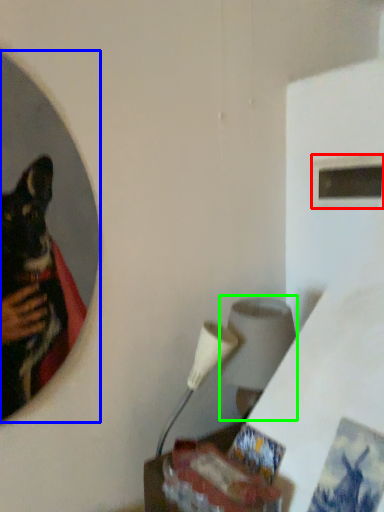
Question: Which object is the closest to the window (highlighted by a red box)? Choose among these: mirror (highlighted by a blue box) or lamp (highlighted by a green box).

Choices:
 (A) mirror
 (B) lamp

Answer: (B)